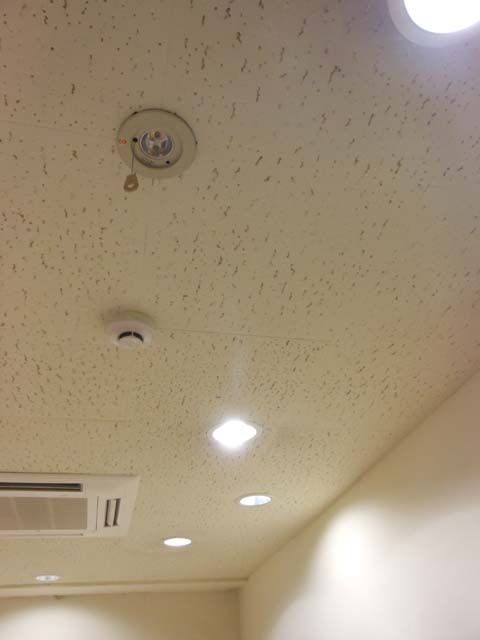
Locate an element on the screen. lights on is located at coordinates (224, 448), (261, 502), (179, 538).